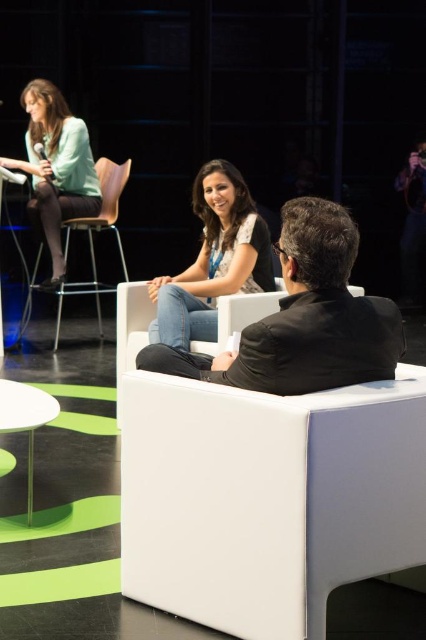
Does point (247, 385) come in front of point (276, 294)?

That is True.

Does black matte suit at center appear over white leather chair at center?

Actually, black matte suit at center is below white leather chair at center.

Locate an element on the screen. black matte suit at center is located at coordinates (304, 317).

Who is taller, matte green shirt at upper left or white leather chair at center?

With more height is matte green shirt at upper left.

Is matte green shirt at upper left to the left of white leather chair at center from the viewer's perspective?

Indeed, matte green shirt at upper left is positioned on the left side of white leather chair at center.

Is point (60, 145) positioned before point (232, 324)?

No, it is not.

Locate an element on the screen. This screenshot has width=426, height=640. matte green shirt at upper left is located at coordinates (55, 166).

Is jeans at center below white glossy table at lower left?

No.

Does jeans at center lie behind white glossy table at lower left?

Yes, it is behind white glossy table at lower left.

Where is `jeans at center`? The width and height of the screenshot is (426, 640). jeans at center is located at coordinates point(213,259).